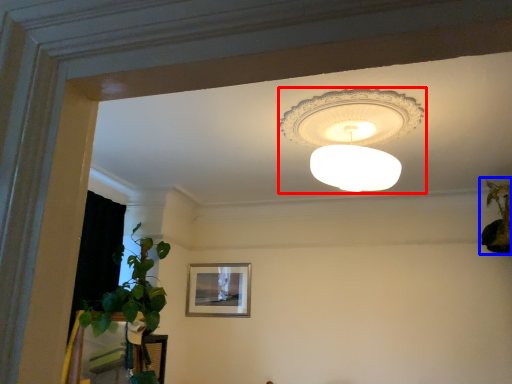
Question: Which of the following is the farthest to the observer, lamp (highlighted by a red box) or houseplant (highlighted by a blue box)?

Choices:
 (A) lamp
 (B) houseplant

Answer: (B)